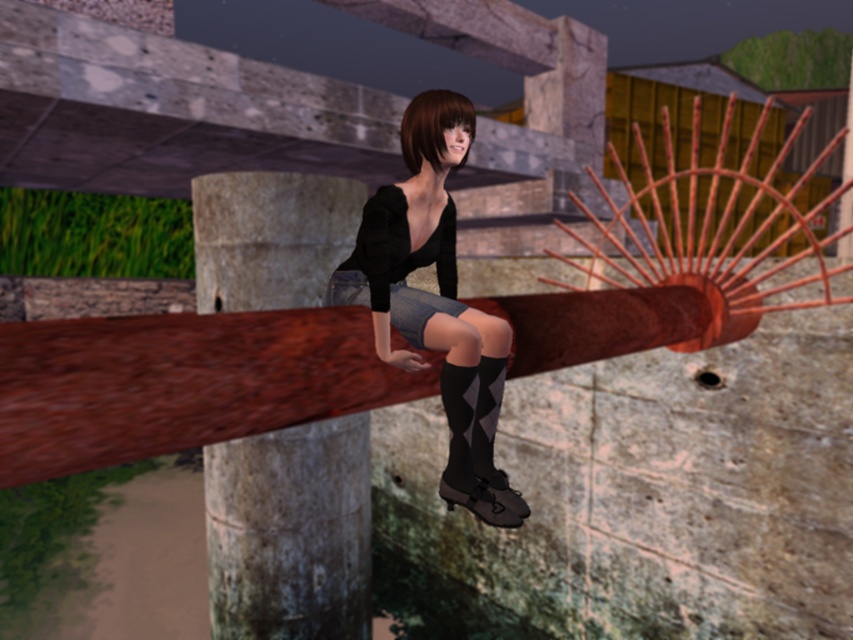
Question: Is rusty metal pole at center thinner than matte black sweater at center?

Choices:
 (A) no
 (B) yes

Answer: (B)

Question: Considering the real-world distances, which object is farthest from the rusty metal pole at center?

Choices:
 (A) matte black sweater at center
 (B) black textured sock at lower center
 (C) black matte dress at center

Answer: (B)

Question: Among these points, which one is farthest from the camera?

Choices:
 (A) (482, 362)
 (B) (384, 252)
 (C) (196, 298)

Answer: (C)

Question: Is matte black sweater at center behind black matte dress at center?

Choices:
 (A) no
 (B) yes

Answer: (A)

Question: Observing the image, what is the correct spatial positioning of rusty metal pole at center in reference to black matte dress at center?

Choices:
 (A) above
 (B) below

Answer: (B)

Question: Which object is closer to the camera taking this photo?

Choices:
 (A) rusty metal pole at center
 (B) matte black sweater at center
 (C) black textured sock at lower center
 (D) black matte dress at center

Answer: (B)